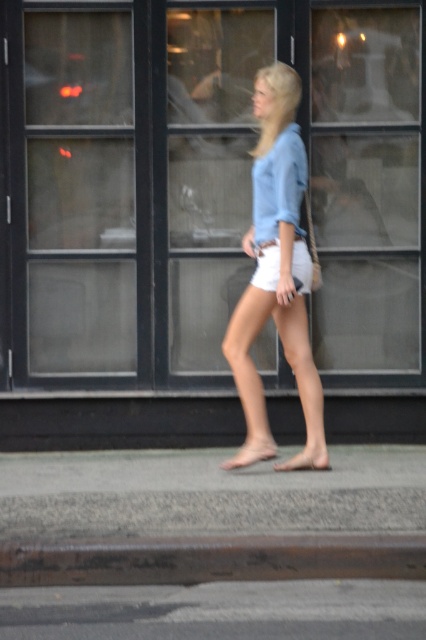
Does gray asphalt at lower center have a lesser height compared to white cotton shorts at center?

Yes.

Who is positioned more to the left, gray asphalt at lower center or white cotton shorts at center?

Positioned to the left is gray asphalt at lower center.

Which is in front, point (195, 621) or point (302, 285)?

Point (195, 621) is more forward.

I want to click on gray asphalt at lower center, so click(x=218, y=611).

Is point (250, 38) farther from camera compared to point (230, 614)?

Yes.

Is point (221, 100) positioned after point (393, 609)?

Yes, it is.

What are the coordinates of `transparent glass shop window at center` in the screenshot? It's located at (201, 184).

Is point (204, 150) farther from viewer compared to point (230, 576)?

Yes, point (204, 150) is farther from viewer.

Between transparent glass shop window at center and rusty metal curb at lower center, which one has less height?

rusty metal curb at lower center

Is point (34, 77) positioned behind point (279, 541)?

Yes, it is behind point (279, 541).

Locate an element on the screen. The image size is (426, 640). transparent glass shop window at center is located at coordinates (201, 184).